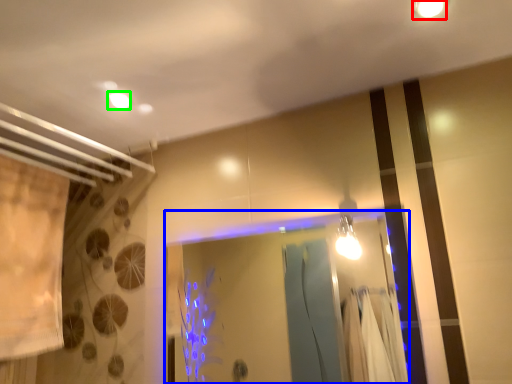
Question: Based on their relative distances, which object is nearer to light fixture (highlighted by a red box)? Choose from glass door (highlighted by a blue box) and lighting (highlighted by a green box).

Choices:
 (A) glass door
 (B) lighting

Answer: (B)